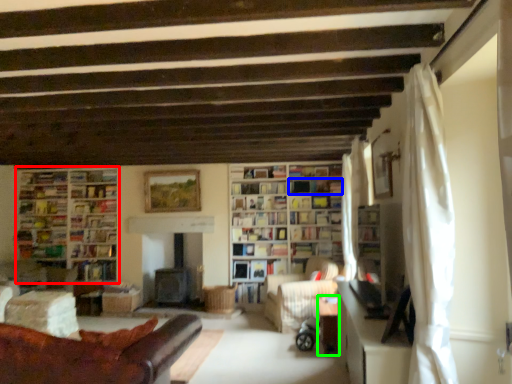
Question: Which is nearer to the bookcase (highlighted by a red box)? shelf (highlighted by a blue box) or table (highlighted by a green box).

Choices:
 (A) shelf
 (B) table

Answer: (A)